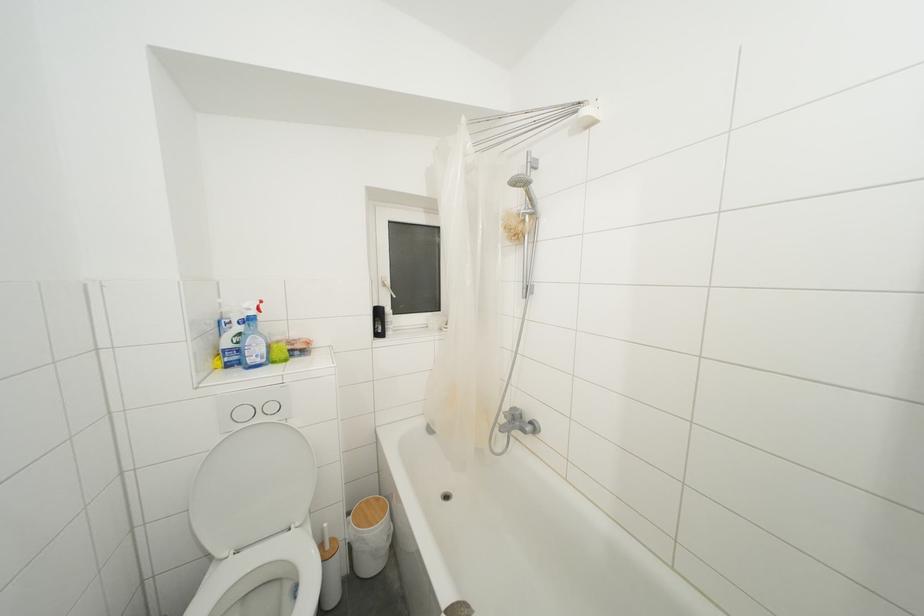
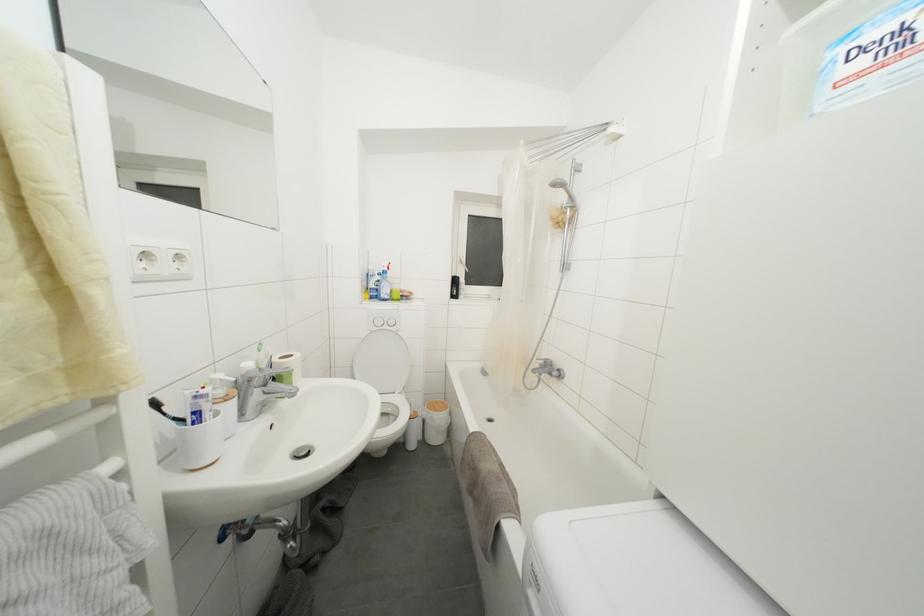
In the second image, find the point that corresponds to the point at 237,363 in the first image.

(379, 300)